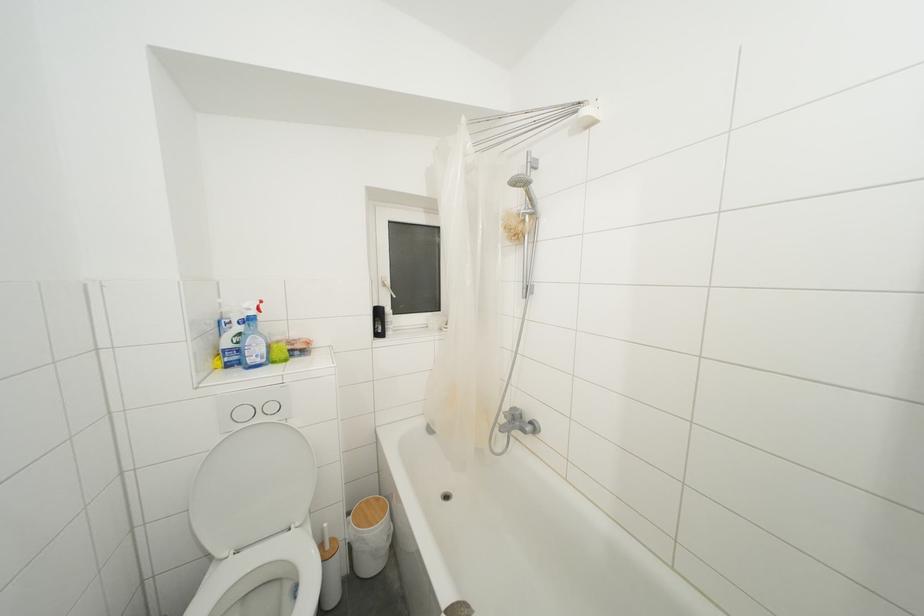
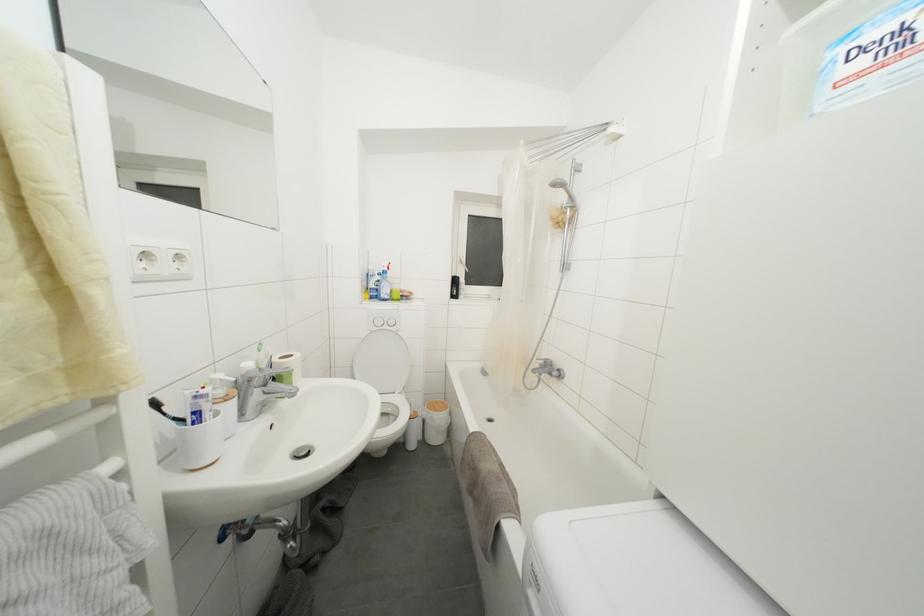
In the second image, find the point that corresponds to the point at 237,363 in the first image.

(379, 300)